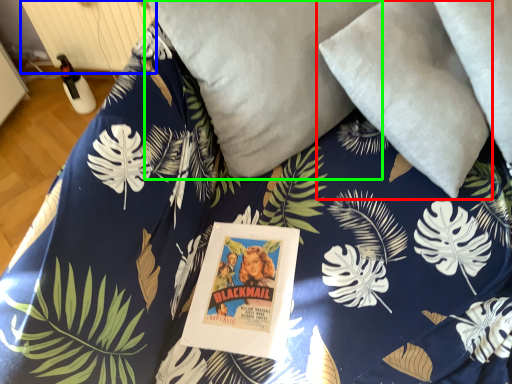
Question: Which object is positioned closest to pillow (highlighted by a red box)? Select from radiator (highlighted by a blue box) and pillow (highlighted by a green box).

Choices:
 (A) radiator
 (B) pillow

Answer: (B)